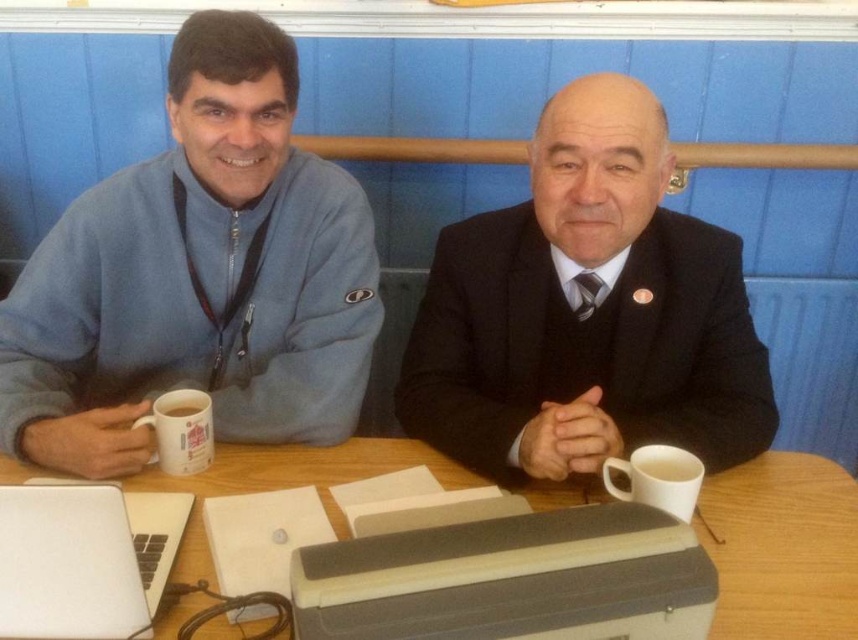
Question: Which of the following is the farthest from the observer?

Choices:
 (A) silver metallic laptop at lower left
 (B) wooden table at center
 (C) white matte cup at right

Answer: (C)

Question: Estimate the real-world distances between objects in this image. Which object is closer to the silver metallic laptop at lower left?

Choices:
 (A) black suit at center
 (B) white ceramic mug at left
 (C) white matte mug at left
 (D) blue fleece jacket at left

Answer: (B)

Question: Is gray plastic printer at center thinner than wooden table at center?

Choices:
 (A) no
 (B) yes

Answer: (B)

Question: Is blue fleece jacket at left positioned behind white matte mug at left?

Choices:
 (A) no
 (B) yes

Answer: (A)

Question: Estimate the real-world distances between objects in this image. Which object is closer to the silver metallic laptop at lower left?

Choices:
 (A) white matte cup at right
 (B) blue fleece jacket at left

Answer: (B)

Question: Does white matte cup at right appear on the left side of white matte mug at left?

Choices:
 (A) no
 (B) yes

Answer: (A)